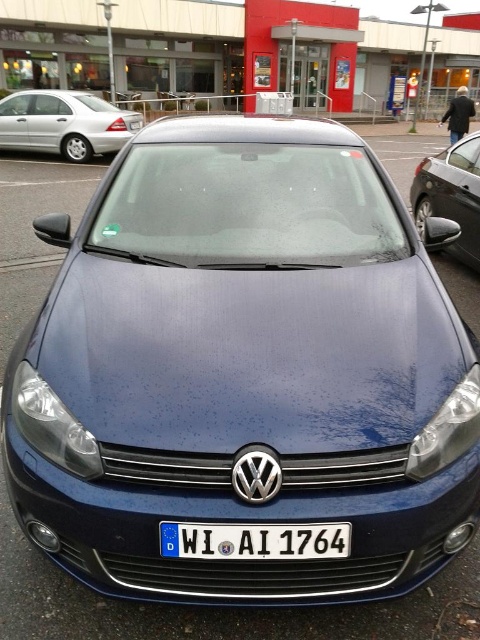
Question: Does white plastic license plate at center appear on the right side of satin black car at right?

Choices:
 (A) yes
 (B) no

Answer: (B)

Question: Which point appears closest to the camera in this image?

Choices:
 (A) (13, 122)
 (B) (247, 536)

Answer: (B)

Question: Does silver metallic sedan at left come behind satin black car at right?

Choices:
 (A) no
 (B) yes

Answer: (B)

Question: Which of the following is the farthest from the observer?

Choices:
 (A) (158, 531)
 (B) (47, 141)
 (C) (422, 202)

Answer: (B)

Question: Which of the following is the farthest from the observer?

Choices:
 (A) satin black car at right
 (B) white plastic license plate at center
 (C) silver metallic sedan at left

Answer: (C)

Question: Does silver metallic sedan at left have a larger size compared to satin black car at right?

Choices:
 (A) no
 (B) yes

Answer: (B)